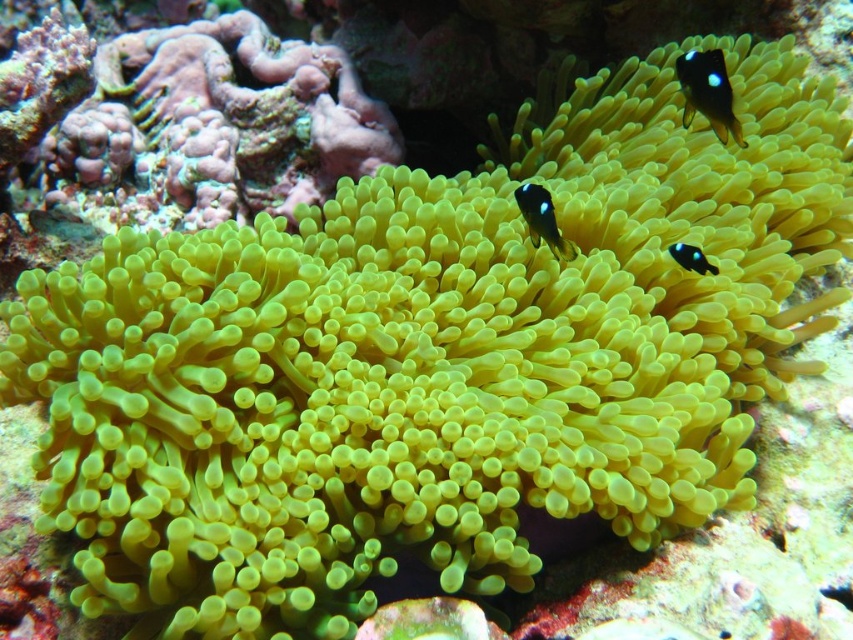
Who is shorter, black glossy fish at center or blue glossy fish at center?

blue glossy fish at center

Measure the distance between black glossy fish at center and blue glossy fish at center.

They are 29.24 centimeters apart.

Measure the distance between point (x=531, y=189) and camera.

Point (x=531, y=189) is 1.88 meters away from camera.

In order to click on black glossy fish at center in this screenshot , I will do `click(543, 220)`.

Does black glossy fish at upper right appear on the left side of black glossy fish at center?

Incorrect, black glossy fish at upper right is not on the left side of black glossy fish at center.

Who is shorter, black glossy fish at upper right or black glossy fish at center?

Standing shorter between the two is black glossy fish at center.

Between point (686, 124) and point (525, 193), which one is positioned behind?

The point (686, 124) is more distant.

Where is `black glossy fish at upper right`? This screenshot has width=853, height=640. black glossy fish at upper right is located at coordinates (x=708, y=92).

Which is more to the right, black glossy fish at upper right or blue glossy fish at center?

From the viewer's perspective, black glossy fish at upper right appears more on the right side.

Does black glossy fish at upper right lie in front of blue glossy fish at center?

That is False.

Image resolution: width=853 pixels, height=640 pixels. Describe the element at coordinates (708, 92) in the screenshot. I see `black glossy fish at upper right` at that location.

Where is `black glossy fish at upper right`? black glossy fish at upper right is located at coordinates (708, 92).